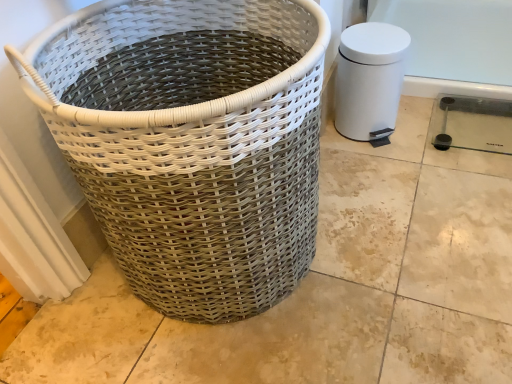
Identify the location of free spot in front of white matte water heater at right. [x=388, y=172].